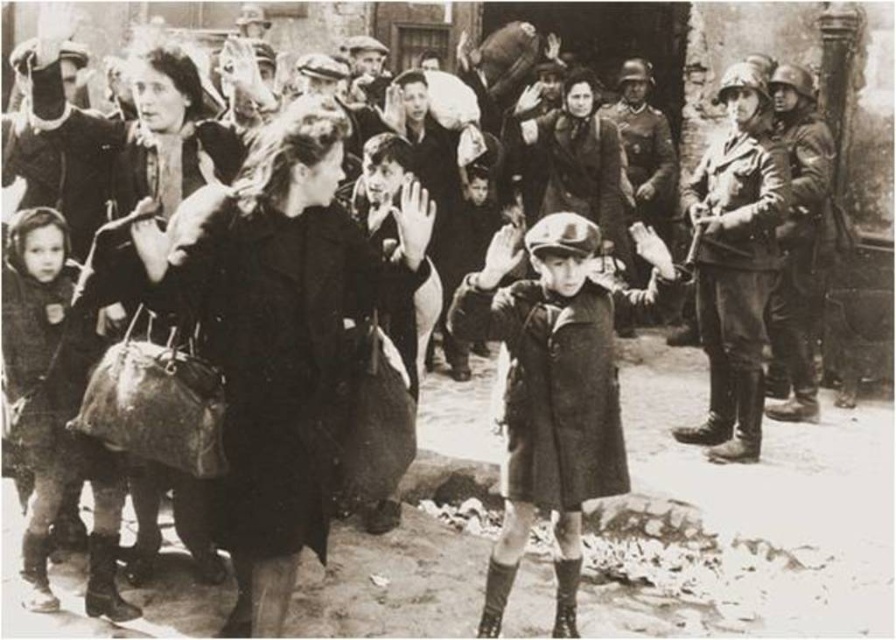
Question: Which object is farther from the camera taking this photo?

Choices:
 (A) dark wool coat at center
 (B) dark woolen coat at center

Answer: (B)

Question: Among these points, which one is nearest to the camera?

Choices:
 (A) (515, 518)
 (B) (140, 243)

Answer: (B)

Question: Considering the real-world distances, which object is closest to the dark woolen coat at center?

Choices:
 (A) dark wool coat at center
 (B) dark gray fabric coat at left

Answer: (A)

Question: Does dark wool coat at center have a lesser width compared to dark gray fabric coat at left?

Choices:
 (A) yes
 (B) no

Answer: (B)

Question: Is dark woolen coat at center bigger than dark gray fabric coat at left?

Choices:
 (A) no
 (B) yes

Answer: (B)

Question: Considering the relative positions of dark woolen coat at center and dark gray fabric coat at left in the image provided, where is dark woolen coat at center located with respect to dark gray fabric coat at left?

Choices:
 (A) right
 (B) left

Answer: (A)